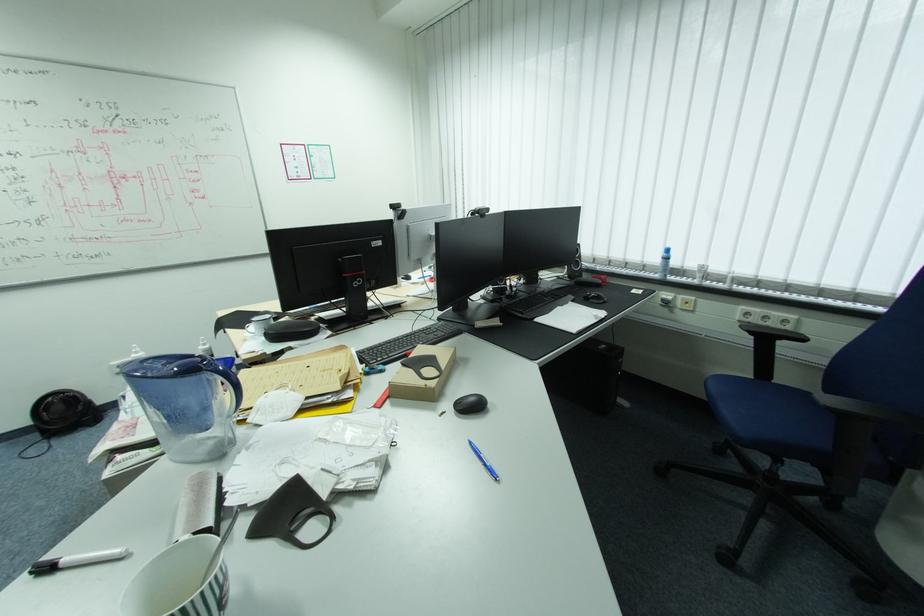
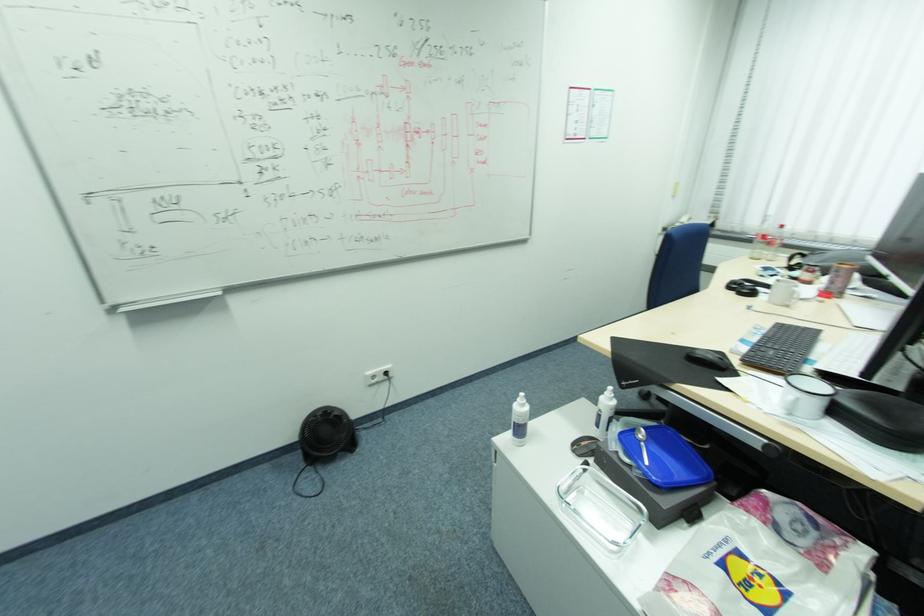
In the second image, find the point that corresponds to (x=43, y=435) in the first image.

(304, 456)